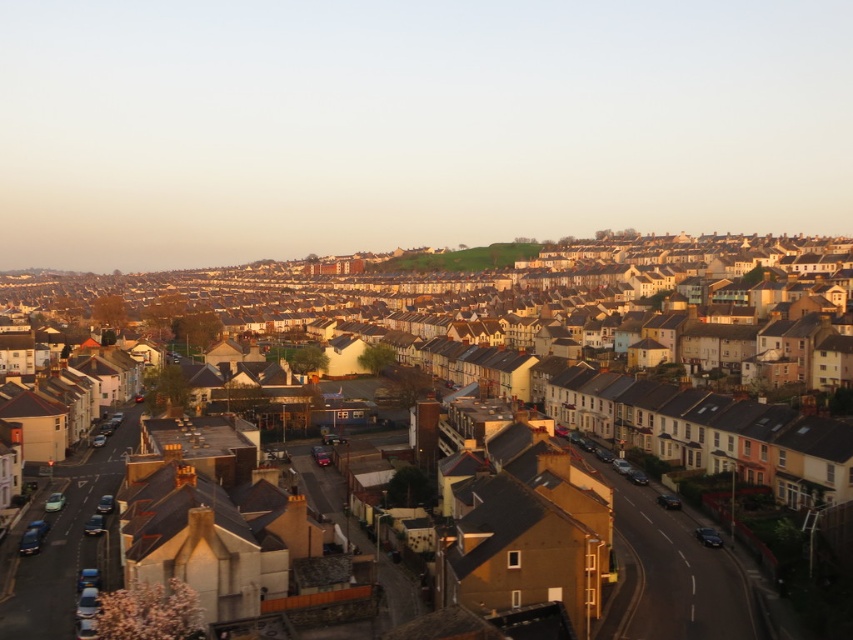
Is point (352, 493) closer to camera compared to point (419, 259)?

Yes.

Can you confirm if white matte houses at center is shorter than green grassy hill at center?

Incorrect, white matte houses at center's height does not fall short of green grassy hill at center's.

Is point (605, 404) positioned before point (514, 260)?

Yes.

Where is `white matte houses at center`? This screenshot has width=853, height=640. white matte houses at center is located at coordinates (595, 472).